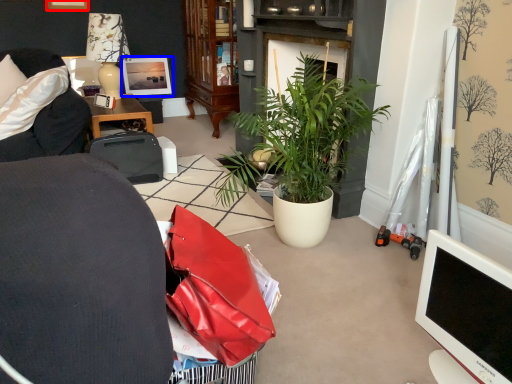
Question: Which point is closer to the camera, picture frame (highlighted by a red box) or picture frame (highlighted by a blue box)?

Choices:
 (A) picture frame
 (B) picture frame

Answer: (A)